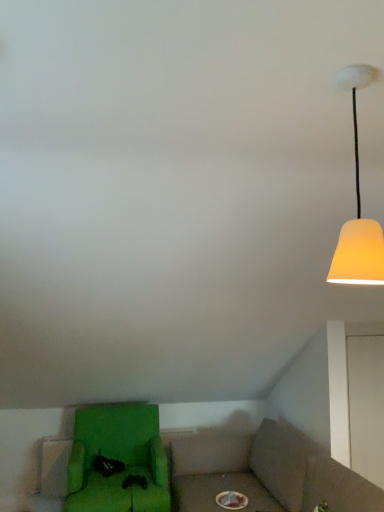
Find the location of a particular element. green fabric chair at lower left is located at coordinates (118, 460).

What do you see at coordinates (118, 460) in the screenshot?
I see `green fabric chair at lower left` at bounding box center [118, 460].

In order to click on matte yellow lampshade at upper right in this screenshot , I will do `click(358, 208)`.

What is the approximate width of matte yellow lampshade at upper right?

It is 7.04 inches.

What do you see at coordinates (358, 208) in the screenshot? The image size is (384, 512). I see `matte yellow lampshade at upper right` at bounding box center [358, 208].

This screenshot has height=512, width=384. Identify the location of green fabric chair at lower left. (118, 460).

Is matte yellow lampshade at upper right to the right of green fabric chair at lower left from the viewer's perspective?

Indeed, matte yellow lampshade at upper right is positioned on the right side of green fabric chair at lower left.

Which object is further away from the camera, matte yellow lampshade at upper right or green fabric chair at lower left?

green fabric chair at lower left is more distant.

Considering the positions of points (355, 106) and (152, 505), is point (355, 106) closer to camera compared to point (152, 505)?

That is True.

From the image's perspective, does matte yellow lampshade at upper right appear lower than green fabric chair at lower left?

No, from the image's perspective, matte yellow lampshade at upper right is not beneath green fabric chair at lower left.

From a real-world perspective, which is physically above, matte yellow lampshade at upper right or green fabric chair at lower left?

In real-world perspective, matte yellow lampshade at upper right is above.

Considering the sizes of objects matte yellow lampshade at upper right and green fabric chair at lower left in the image provided, who is thinner, matte yellow lampshade at upper right or green fabric chair at lower left?

matte yellow lampshade at upper right.

Considering the sizes of matte yellow lampshade at upper right and green fabric chair at lower left in the image, is matte yellow lampshade at upper right taller or shorter than green fabric chair at lower left?

Considering their sizes, matte yellow lampshade at upper right has less height than green fabric chair at lower left.

Can you confirm if matte yellow lampshade at upper right is smaller than green fabric chair at lower left?

Yes.

Looking at this image, is matte yellow lampshade at upper right spatially inside green fabric chair at lower left, or outside of it?

matte yellow lampshade at upper right is outside green fabric chair at lower left.

Is matte yellow lampshade at upper right next to green fabric chair at lower left?

There is a gap between matte yellow lampshade at upper right and green fabric chair at lower left.

Is matte yellow lampshade at upper right facing away from green fabric chair at lower left?

No, matte yellow lampshade at upper right's orientation is not away from green fabric chair at lower left.

Locate an element on the screen. The height and width of the screenshot is (512, 384). lamp above the green fabric chair at lower left (from the image's perspective) is located at coordinates (358, 208).

Considering the relative positions of green fabric chair at lower left and matte yellow lampshade at upper right in the image provided, is green fabric chair at lower left to the left or to the right of matte yellow lampshade at upper right?

In the image, green fabric chair at lower left appears on the left side of matte yellow lampshade at upper right.

Consider the image. Does green fabric chair at lower left lie in front of matte yellow lampshade at upper right?

That is False.

Between point (128, 421) and point (376, 243), which one is positioned behind?

The point (128, 421) is more distant.

From the image's perspective, which object appears higher, green fabric chair at lower left or matte yellow lampshade at upper right?

matte yellow lampshade at upper right is shown above in the image.

From a real-world perspective, which object stands above the other?

In real-world perspective, matte yellow lampshade at upper right is above.

Which object is wider, green fabric chair at lower left or matte yellow lampshade at upper right?

green fabric chair at lower left is wider.

Is green fabric chair at lower left shorter than matte yellow lampshade at upper right?

Incorrect, the height of green fabric chair at lower left does not fall short of that of matte yellow lampshade at upper right.

Does green fabric chair at lower left have a smaller size compared to matte yellow lampshade at upper right?

No, green fabric chair at lower left is not smaller than matte yellow lampshade at upper right.

Which is correct: green fabric chair at lower left is inside matte yellow lampshade at upper right, or outside of it?

green fabric chair at lower left is spatially situated outside matte yellow lampshade at upper right.

Would you say green fabric chair at lower left is a long distance from matte yellow lampshade at upper right?

green fabric chair at lower left is far away from matte yellow lampshade at upper right.

Is green fabric chair at lower left oriented away from matte yellow lampshade at upper right?

No, green fabric chair at lower left is not facing the opposite direction of matte yellow lampshade at upper right.

Can you tell me how much green fabric chair at lower left and matte yellow lampshade at upper right differ in facing direction?

The facing directions of green fabric chair at lower left and matte yellow lampshade at upper right are 92.7 degrees apart.

In the image, there is a green fabric chair at lower left. Where is `lamp above it (from the image's perspective)`? lamp above it (from the image's perspective) is located at coordinates (358, 208).

Identify the location of lamp in front of the green fabric chair at lower left. The width and height of the screenshot is (384, 512). (358, 208).

Locate an element on the screen. furniture on the left side of matte yellow lampshade at upper right is located at coordinates (118, 460).